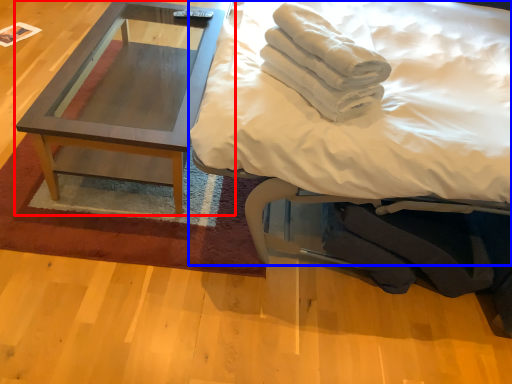
Question: Among these objects, which one is farthest to the camera, coffee table (highlighted by a red box) or bed (highlighted by a blue box)?

Choices:
 (A) coffee table
 (B) bed

Answer: (A)